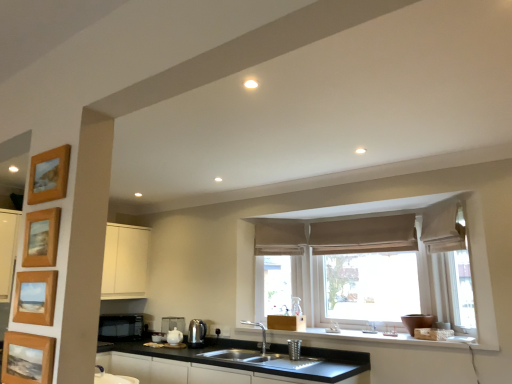
Question: From the image's perspective, does metallic silver cup at sink, the fourth appliance viewed from the left, appear higher than wooden picture frame at upper left, which is the 4th picture frame from bottom to top?

Choices:
 (A) no
 (B) yes

Answer: (A)

Question: Are metallic silver cup at sink, the fourth appliance viewed from the left, and wooden picture frame at upper left, which appears as the 1th picture frame when viewed from the top, making contact?

Choices:
 (A) yes
 (B) no

Answer: (B)

Question: Can you confirm if metallic silver cup at sink, positioned as the first appliance in right-to-left order, is bigger than wooden picture frame at upper left, which appears as the 1th picture frame when viewed from the top?

Choices:
 (A) no
 (B) yes

Answer: (B)

Question: From a real-world perspective, is metallic silver cup at sink, the fourth appliance viewed from the left, beneath wooden picture frame at upper left, which appears as the 1th picture frame when viewed from the top?

Choices:
 (A) no
 (B) yes

Answer: (B)

Question: Is metallic silver cup at sink, the fourth appliance viewed from the back, closer to the viewer compared to wooden picture frame at upper left, which is the 4th picture frame from bottom to top?

Choices:
 (A) yes
 (B) no

Answer: (B)

Question: Does metallic silver cup at sink, the fourth appliance viewed from the left, have a greater width compared to wooden picture frame at upper left, which is the 4th picture frame from bottom to top?

Choices:
 (A) no
 (B) yes

Answer: (B)

Question: From a real-world perspective, does beige fabric curtain at right sit lower than black matte microwave at lower left, marked as the first appliance in a left-to-right arrangement?

Choices:
 (A) yes
 (B) no

Answer: (B)

Question: Considering the relative positions of beige fabric curtain at right and black matte microwave at lower left, which is counted as the fourth appliance, starting from the right, in the image provided, is beige fabric curtain at right to the right of black matte microwave at lower left, which is counted as the fourth appliance, starting from the right, from the viewer's perspective?

Choices:
 (A) yes
 (B) no

Answer: (A)

Question: Is beige fabric curtain at right behind black matte microwave at lower left, marked as the first appliance in a left-to-right arrangement?

Choices:
 (A) yes
 (B) no

Answer: (B)

Question: Does beige fabric curtain at right contain black matte microwave at lower left, which is counted as the fourth appliance, starting from the right?

Choices:
 (A) yes
 (B) no

Answer: (B)

Question: Is beige fabric curtain at right in front of black matte microwave at lower left, the 1th appliance positioned from the back?

Choices:
 (A) yes
 (B) no

Answer: (A)

Question: From a real-world perspective, is beige fabric curtain at right on top of black matte microwave at lower left, which is counted as the fourth appliance, starting from the right?

Choices:
 (A) yes
 (B) no

Answer: (A)

Question: From the image's perspective, is white ceramic teapot at lower center, positioned as the 2th appliance in back-to-front order, below wooden picture frame at upper left, the third picture frame from the bottom?

Choices:
 (A) yes
 (B) no

Answer: (A)